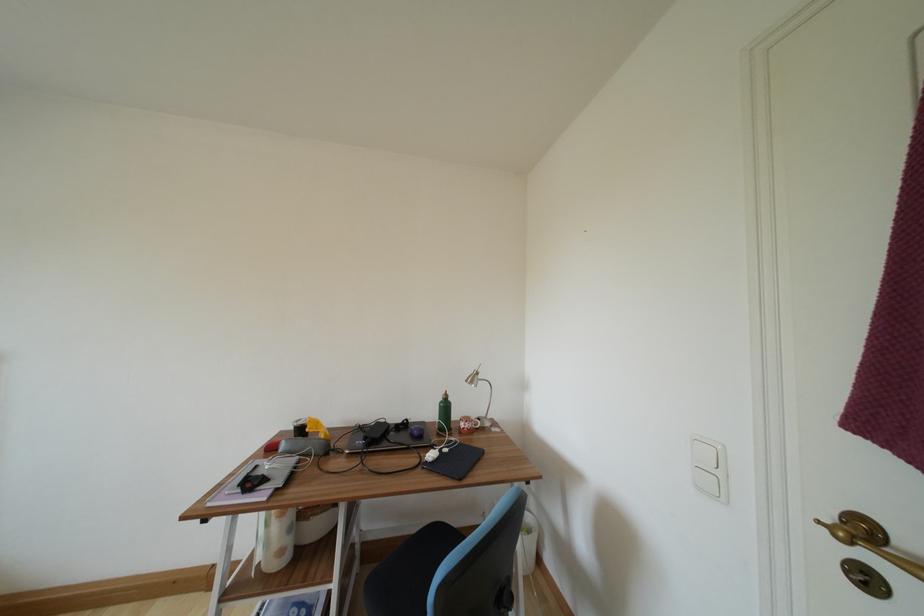
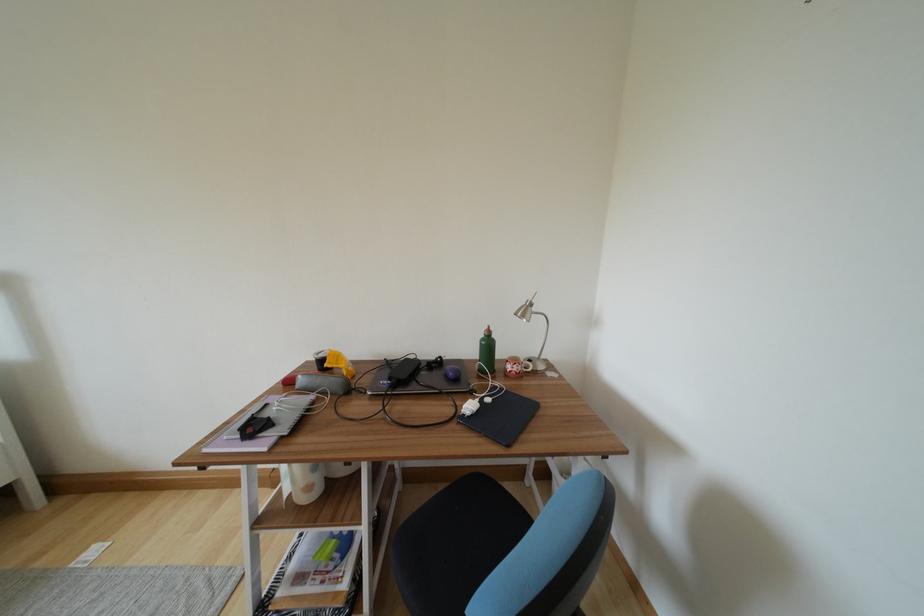
The point at (x=287, y=450) is marked in the first image. Where is the corresponding point in the second image?

(306, 385)